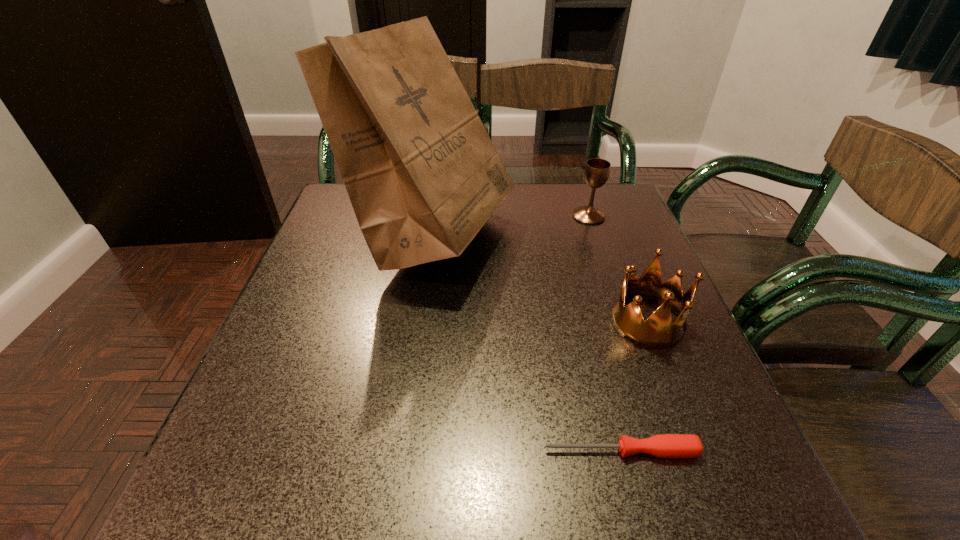
Locate an element on the screen. This screenshot has width=960, height=540. vacant space in between the screwdriver and the chalice is located at coordinates (605, 333).

You are a GUI agent. You are given a task and a screenshot of the screen. Output one action in this format:
    pyautogui.click(x=<x>, y=<y>)
    Task: Click on the unoccupied position between the crown and the screwdriver
    The image size is (960, 540).
    Given the screenshot: What is the action you would take?
    pyautogui.click(x=635, y=386)

The image size is (960, 540). I want to click on vacant region between the tallest object and the crown, so click(x=540, y=278).

Where is `vacant area that lies between the grocery bag and the chalice`? The image size is (960, 540). vacant area that lies between the grocery bag and the chalice is located at coordinates (512, 225).

At what (x,y) coordinates should I click in order to perform the action: click on vacant space that's between the tallest object and the nearest object. Please return your answer as a coordinate pair (x, y). This screenshot has height=540, width=960. Looking at the image, I should click on (528, 343).

At what (x,y) coordinates should I click in order to perform the action: click on vacant area that lies between the leftmost object and the chalice. Please return your answer as a coordinate pair (x, y). Looking at the image, I should click on (512, 225).

Identify which object is the third nearest to the shortest object. Please provide its 2D coordinates. Your answer should be formatted as a tuple, i.e. [(x, y)], where the tuple contains the x and y coordinates of a point satisfying the conditions above.

[(597, 170)]

Select which object appears as the closest to the grocery bag. Please provide its 2D coordinates. Your answer should be formatted as a tuple, i.e. [(x, y)], where the tuple contains the x and y coordinates of a point satisfying the conditions above.

[(597, 170)]

The image size is (960, 540). In order to click on free location that satisfies the following two spatial constraints: 1. on the front side of the chalice; 2. at the tip of the shortest object in this screenshot , I will do `click(668, 451)`.

What are the coordinates of `vacant space that satisfies the following two spatial constraints: 1. on the back side of the chalice; 2. on the right side of the tallest object` in the screenshot? It's located at (437, 216).